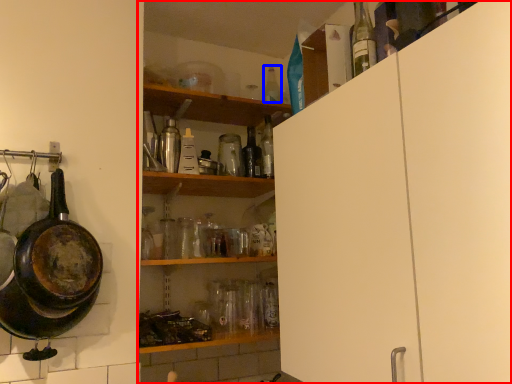
Question: Which of the following is the closest to the observer, shelf (highlighted by a red box) or bottle (highlighted by a blue box)?

Choices:
 (A) shelf
 (B) bottle

Answer: (A)